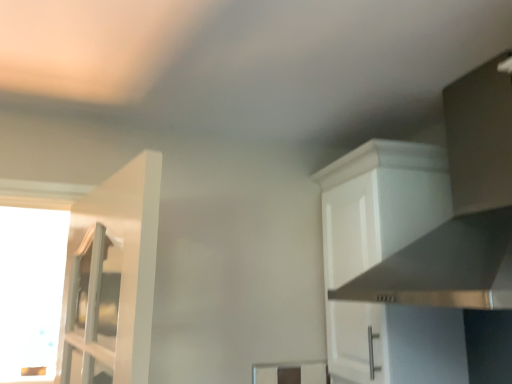
I want to click on transparent glass window at left, so click(31, 290).

From a real-world perspective, which object rests below the other?

white matte cabinet at upper right.

Is stainless steel vent at upper right a part of white matte cabinet at upper right?

No, stainless steel vent at upper right is not inside white matte cabinet at upper right.

Is white matte cabinet at upper right taller than stainless steel vent at upper right?

Correct, white matte cabinet at upper right is much taller as stainless steel vent at upper right.

From the image's perspective, is stainless steel vent at upper right positioned above or below white matte cabinet at upper right?

Clearly, from the image's perspective, stainless steel vent at upper right is above white matte cabinet at upper right.

Is white matte cabinet at upper right at the back of stainless steel vent at upper right?

stainless steel vent at upper right does not have its back to white matte cabinet at upper right.

Does stainless steel vent at upper right have a lesser width compared to white matte cabinet at upper right?

Answer: No.

Does stainless steel vent at upper right appear on the right side of white matte cabinet at upper right?

Yes.

From the image's perspective, is transparent glass window at left positioned above or below white matte cabinet at upper right?

transparent glass window at left is situated lower than white matte cabinet at upper right in the image.

Identify the location of cabinetry located in front of the transparent glass window at left. The image size is (512, 384). (383, 263).

How many degrees apart are the facing directions of transparent glass window at left and white matte cabinet at upper right?

transparent glass window at left and white matte cabinet at upper right are facing 91.2 degrees away from each other.

Is the position of transparent glass window at left more distant than that of white matte cabinet at upper right?

Yes, transparent glass window at left is further from the viewer.

From the image's perspective, does transparent glass window at left appear lower than stainless steel vent at upper right?

Indeed, from the image's perspective, transparent glass window at left is shown beneath stainless steel vent at upper right.

Does transparent glass window at left turn towards stainless steel vent at upper right?

No, transparent glass window at left does not turn towards stainless steel vent at upper right.

In terms of width, does transparent glass window at left look wider or thinner when compared to stainless steel vent at upper right?

Considering their sizes, transparent glass window at left looks slimmer than stainless steel vent at upper right.

Can you confirm if transparent glass window at left is shorter than stainless steel vent at upper right?

No, transparent glass window at left is not shorter than stainless steel vent at upper right.

From the image's perspective, is white matte cabinet at upper right beneath transparent glass window at left?

Actually, white matte cabinet at upper right appears above transparent glass window at left in the image.

Based on the photo, which object is closer to the camera taking this photo, white matte cabinet at upper right or transparent glass window at left?

white matte cabinet at upper right is closer to the camera.

Consider the image. Considering the relative sizes of white matte cabinet at upper right and transparent glass window at left in the image provided, is white matte cabinet at upper right taller than transparent glass window at left?

No, white matte cabinet at upper right is not taller than transparent glass window at left.

Is point (482, 143) behind point (3, 317)?

No, (482, 143) is in front of (3, 317).

Is the surface of stainless steel vent at upper right in direct contact with transparent glass window at left?

They are not placed beside each other.

Is stainless steel vent at upper right smaller than transparent glass window at left?

No.

In terms of height, does stainless steel vent at upper right look taller or shorter compared to transparent glass window at left?

Considering their sizes, stainless steel vent at upper right has less height than transparent glass window at left.

Locate an element on the screen. cabinetry that appears on the left of stainless steel vent at upper right is located at coordinates (383, 263).

Image resolution: width=512 pixels, height=384 pixels. What are the coordinates of `cabinetry behind the stainless steel vent at upper right` in the screenshot? It's located at (383, 263).

Based on their spatial positions, is white matte cabinet at upper right or stainless steel vent at upper right closer to transparent glass window at left?

white matte cabinet at upper right lies closer to transparent glass window at left than the other object.

Considering their positions, is white matte cabinet at upper right positioned further to stainless steel vent at upper right than transparent glass window at left?

transparent glass window at left is further to stainless steel vent at upper right.

Looking at this image, when comparing their distances from transparent glass window at left, does stainless steel vent at upper right or white matte cabinet at upper right seem further?

stainless steel vent at upper right lies further to transparent glass window at left than the other object.

From the picture: Estimate the real-world distances between objects in this image. Which object is closer to stainless steel vent at upper right, transparent glass window at left or white matte cabinet at upper right?

white matte cabinet at upper right lies closer to stainless steel vent at upper right than the other object.

Based on their spatial positions, is stainless steel vent at upper right or transparent glass window at left further from white matte cabinet at upper right?

Based on the image, transparent glass window at left appears to be further to white matte cabinet at upper right.

Estimate the real-world distances between objects in this image. Which object is closer to white matte cabinet at upper right, transparent glass window at left or stainless steel vent at upper right?

Based on the image, stainless steel vent at upper right appears to be nearer to white matte cabinet at upper right.

At what (x,y) coordinates should I click in order to perform the action: click on cabinetry between stainless steel vent at upper right and transparent glass window at left along the z-axis. Please return your answer as a coordinate pair (x, y). Looking at the image, I should click on (383, 263).